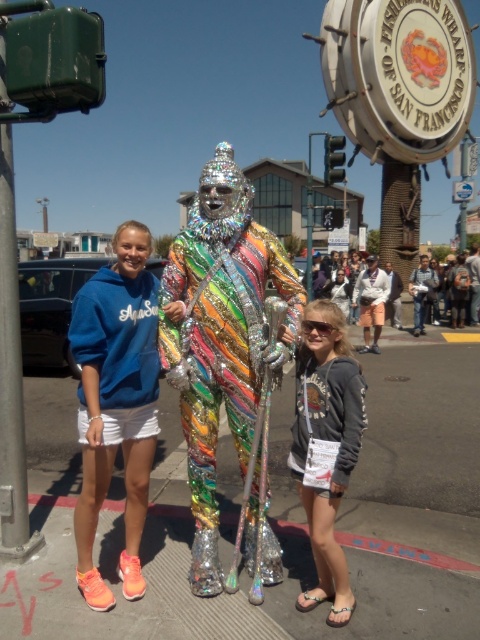
Question: Is metallic reflective pavement at center below metallic pole at left?

Choices:
 (A) no
 (B) yes

Answer: (B)

Question: Which of these objects is positioned closest to the metallic pole at left?

Choices:
 (A) gray hoodie at center
 (B) metallic reflective pavement at center

Answer: (B)

Question: Is blue cotton hoodie at center smaller than gray hoodie at center?

Choices:
 (A) no
 (B) yes

Answer: (A)

Question: Which of these objects is positioned closest to the holographic metallic costume at center?

Choices:
 (A) matte gray hoodie at center
 (B) metallic pole at left

Answer: (B)

Question: Which object is the closest to the gray hoodie at center?

Choices:
 (A) metallic reflective pavement at center
 (B) matte gray hoodie at center
 (C) holographic metallic costume at center
 (D) blue cotton hoodie at center

Answer: (C)

Question: Can you confirm if metallic reflective pavement at center is smaller than gray hoodie at center?

Choices:
 (A) yes
 (B) no

Answer: (A)